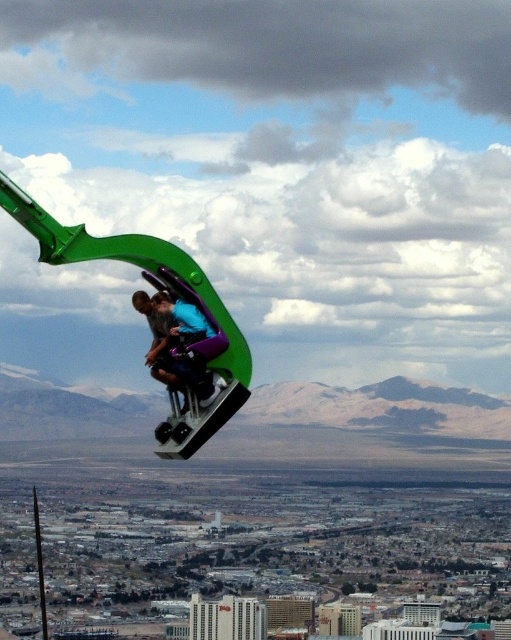
Consider the image. You are a safety inspector evaluating this amusement ride scene. You notice the green matte parachute at center and the blue fabric person at center. According to safety protocols, the parachute must be directly above the person to ensure proper deployment. Is the current positioning compliant with this requirement?

The green matte parachute at center is positioned over the blue fabric person at center, which means it is directly above them. This positioning complies with safety protocols for proper deployment.